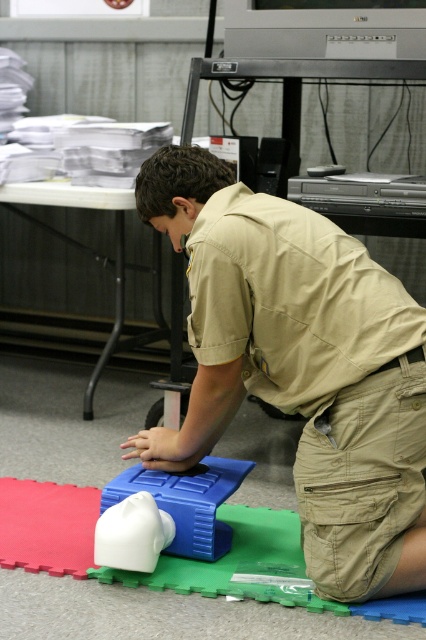
Which is more to the left, white rubber mannequin head at lower center or white rubber toy at center?

white rubber toy at center

Who is more forward, (161, 486) or (98, 529)?

Positioned in front is point (98, 529).

Locate an element on the screen. Image resolution: width=426 pixels, height=640 pixels. white rubber mannequin head at lower center is located at coordinates (187, 500).

Does khaki uniform at center appear over white rubber toy at center?

Yes.

Find the location of a particular element. The width and height of the screenshot is (426, 640). khaki uniform at center is located at coordinates (299, 365).

Where is `khaki uniform at center`? khaki uniform at center is located at coordinates (299, 365).

Does point (307, 493) lie behind point (238, 477)?

No.

Between khaki uniform at center and white rubber mannequin head at lower center, which one has more height?

With more height is khaki uniform at center.

At what (x,y) coordinates should I click in order to perform the action: click on khaki uniform at center. Please return your answer as a coordinate pair (x, y). This screenshot has height=640, width=426. Looking at the image, I should click on (299, 365).